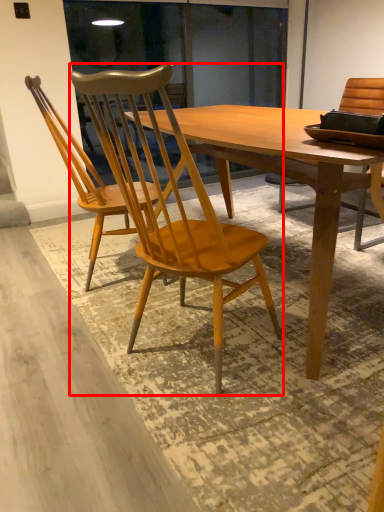
Question: From the image's perspective, where is chair (annotated by the red box) located relative to chair?

Choices:
 (A) above
 (B) below

Answer: (B)